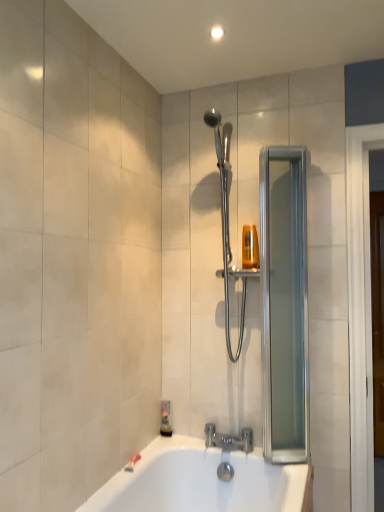
Question: Does polished chrome shower at center have a lesser width compared to silver metallic faucet at lower center?

Choices:
 (A) yes
 (B) no

Answer: (B)

Question: Is polished chrome shower at center bigger than silver metallic faucet at lower center?

Choices:
 (A) no
 (B) yes

Answer: (B)

Question: Is polished chrome shower at center to the right of silver metallic faucet at lower center from the viewer's perspective?

Choices:
 (A) no
 (B) yes

Answer: (B)

Question: From the image's perspective, is polished chrome shower at center under silver metallic faucet at lower center?

Choices:
 (A) yes
 (B) no

Answer: (B)

Question: From a real-world perspective, is polished chrome shower at center located beneath silver metallic faucet at lower center?

Choices:
 (A) no
 (B) yes

Answer: (A)

Question: Considering the positions of clear glass screen door at right and translucent plastic soap dispenser at lower left in the image, is clear glass screen door at right wider or thinner than translucent plastic soap dispenser at lower left?

Choices:
 (A) wide
 (B) thin

Answer: (A)

Question: From the image's perspective, relative to translucent plastic soap dispenser at lower left, is clear glass screen door at right above or below?

Choices:
 (A) below
 (B) above

Answer: (B)

Question: Visually, is clear glass screen door at right positioned to the left or to the right of translucent plastic soap dispenser at lower left?

Choices:
 (A) right
 (B) left

Answer: (A)

Question: From their relative heights in the image, would you say clear glass screen door at right is taller or shorter than translucent plastic soap dispenser at lower left?

Choices:
 (A) tall
 (B) short

Answer: (A)

Question: Do you think clear glass screen door at right is within silver metallic faucet at lower center, or outside of it?

Choices:
 (A) inside
 (B) outside

Answer: (B)

Question: Based on their positions, is clear glass screen door at right located to the left or right of silver metallic faucet at lower center?

Choices:
 (A) right
 (B) left

Answer: (A)

Question: Is point [x=291, y=202] closer or farther from the camera than point [x=233, y=441]?

Choices:
 (A) farther
 (B) closer

Answer: (B)

Question: From a real-world perspective, is clear glass screen door at right positioned above or below silver metallic faucet at lower center?

Choices:
 (A) below
 (B) above

Answer: (B)

Question: Considering the relative positions of translucent plastic soap dispenser at lower left and silver metallic faucet at lower center in the image provided, is translucent plastic soap dispenser at lower left to the left or to the right of silver metallic faucet at lower center?

Choices:
 (A) right
 (B) left

Answer: (B)

Question: Is point (163, 428) closer or farther from the camera than point (243, 436)?

Choices:
 (A) closer
 (B) farther

Answer: (B)